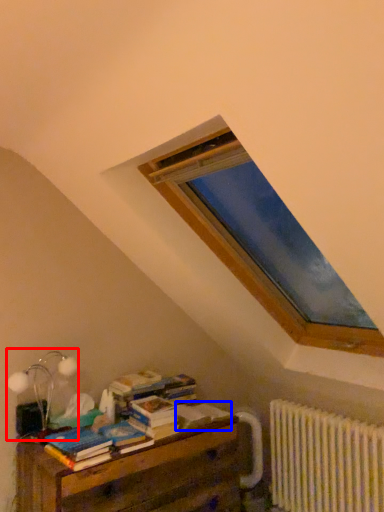
Question: Among these objects, which one is nearest to the camera, table lamp (highlighted by a red box) or paperback book (highlighted by a blue box)?

Choices:
 (A) table lamp
 (B) paperback book

Answer: (A)